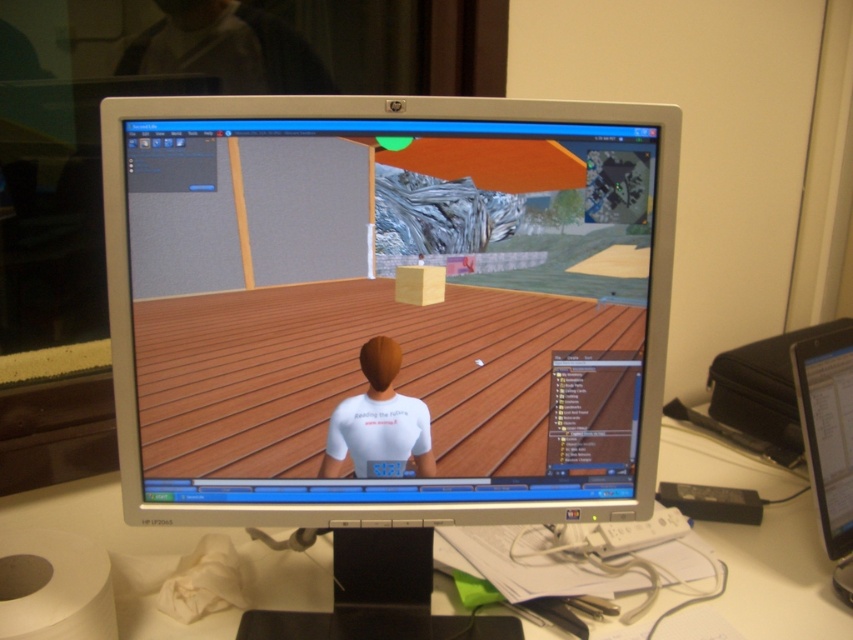
Between white paper at lower center and black plastic monitor at right, which one is positioned lower?

white paper at lower center is below.

Does white paper at lower center have a greater width compared to black plastic monitor at right?

Correct, the width of white paper at lower center exceeds that of black plastic monitor at right.

Is point (190, 534) positioned in front of point (824, 540)?

No.

What are the coordinates of `white paper at lower center` in the screenshot? It's located at (778, 577).

Is silver metallic monitor at center further to the viewer compared to white matte shirt at center?

No, it is in front of white matte shirt at center.

Can you confirm if silver metallic monitor at center is smaller than white matte shirt at center?

No, silver metallic monitor at center is not smaller than white matte shirt at center.

Does point (538, 406) lie behind point (399, 346)?

Yes.

Where is `silver metallic monitor at center`? This screenshot has width=853, height=640. silver metallic monitor at center is located at coordinates (386, 324).

Who is positioned more to the left, silver metallic monitor at center or black plastic monitor at right?

silver metallic monitor at center

Can you confirm if silver metallic monitor at center is smaller than black plastic monitor at right?

No, silver metallic monitor at center is not smaller than black plastic monitor at right.

Who is more forward, (294,524) or (838,481)?

Point (294,524) is more forward.

At what (x,y) coordinates should I click in order to perform the action: click on silver metallic monitor at center. Please return your answer as a coordinate pair (x, y). The image size is (853, 640). Looking at the image, I should click on (386, 324).